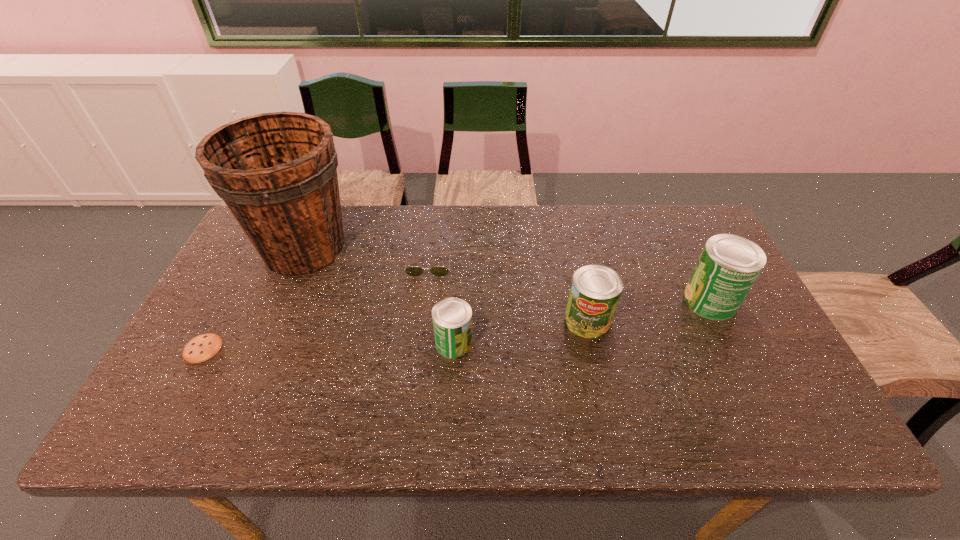
This screenshot has width=960, height=540. I want to click on the leftmost can, so click(452, 317).

I want to click on the third shortest object, so click(x=452, y=317).

Locate an element on the screen. Image resolution: width=960 pixels, height=540 pixels. the second can from right to left is located at coordinates (595, 291).

At what (x,y) coordinates should I click in order to perform the action: click on the third tallest object. Please return your answer as a coordinate pair (x, y). Image resolution: width=960 pixels, height=540 pixels. Looking at the image, I should click on (595, 291).

Find the location of `the rightmost can`. the rightmost can is located at coordinates (729, 264).

The width and height of the screenshot is (960, 540). I want to click on the tallest can, so click(729, 264).

The height and width of the screenshot is (540, 960). Find the location of `bucket`. bucket is located at coordinates (277, 172).

Where is `the second shortest object`? This screenshot has height=540, width=960. the second shortest object is located at coordinates (413, 271).

Identify the location of the shortest object. Image resolution: width=960 pixels, height=540 pixels. (203, 347).

Locate an element on the screen. vacant point located 0.070m on the front of the leftmost can is located at coordinates (452, 384).